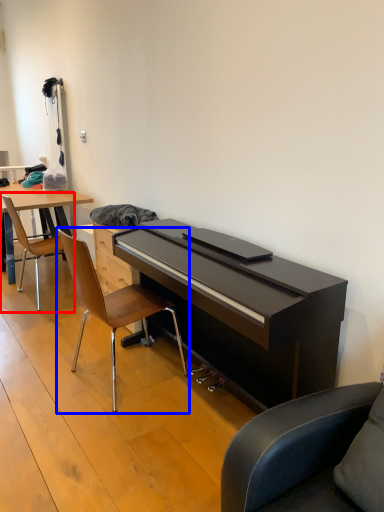
Question: Which point is closer to the camera, chair (highlighted by a red box) or chair (highlighted by a blue box)?

Choices:
 (A) chair
 (B) chair

Answer: (B)